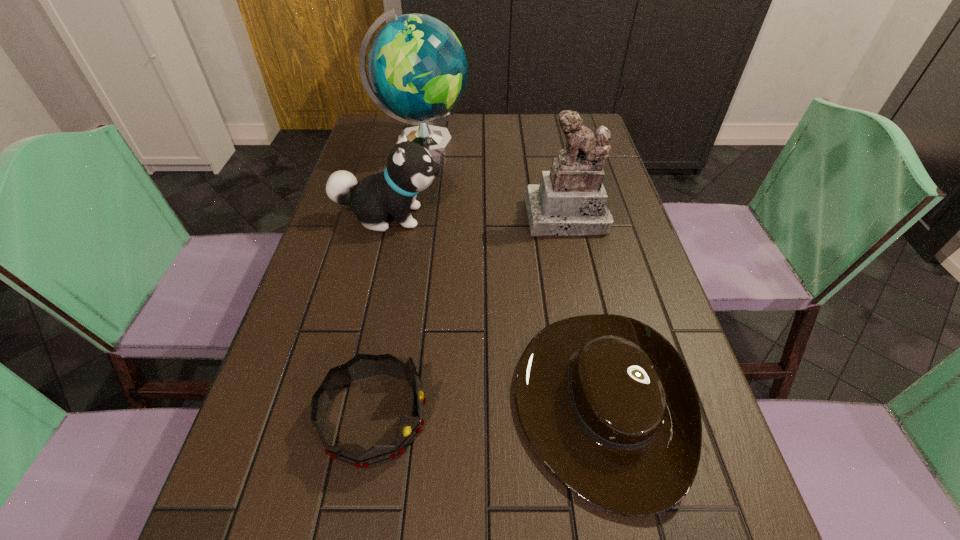
Locate an element on the screen. The width and height of the screenshot is (960, 540). the tallest object is located at coordinates (417, 67).

Where is `the farthest object`? the farthest object is located at coordinates (417, 67).

At what (x,y) coordinates should I click in order to perform the action: click on figurine. Please return your answer as a coordinate pair (x, y). Image resolution: width=960 pixels, height=540 pixels. Looking at the image, I should click on tap(571, 200).

The height and width of the screenshot is (540, 960). Find the location of `puppy`. puppy is located at coordinates (410, 169).

Find the location of a particular element. tiara is located at coordinates click(x=361, y=366).

The width and height of the screenshot is (960, 540). Find the location of `cowboy hat`. cowboy hat is located at coordinates (606, 402).

The height and width of the screenshot is (540, 960). Find the location of `vacant space located on the front surface of the farthest object`. vacant space located on the front surface of the farthest object is located at coordinates (514, 144).

The image size is (960, 540). Identify the location of vacant space situated on the front-facing side of the figurine. (588, 308).

In order to click on free space located 0.400m at the face of the puppy in this screenshot , I will do `click(599, 217)`.

Locate an element on the screen. The image size is (960, 540). free space located 0.240m at the front of the tiara with jewels is located at coordinates (567, 417).